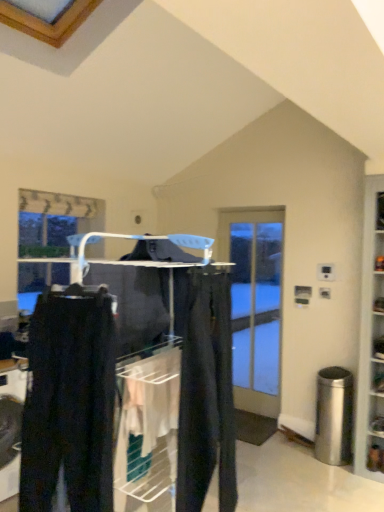
Describe the element at coordinates (128, 385) in the screenshot. I see `matte black pants at center` at that location.

What do you see at coordinates (255, 304) in the screenshot? The width and height of the screenshot is (384, 512). I see `clear glass door at center` at bounding box center [255, 304].

At what (x,y) coordinates should I click in order to perform the action: click on dark gray pants at center. Please return your answer as a coordinate pair (x, y). The image size is (384, 512). Looking at the image, I should click on (69, 402).

Which is behind, dark gray pants at center or matte black pants at center?

matte black pants at center is more distant.

From a real-world perspective, is dark gray pants at center physically below matte black pants at center?

No.

From the picture: From the image's perspective, is dark gray pants at center below matte black pants at center?

Actually, dark gray pants at center appears above matte black pants at center in the image.

From their relative heights in the image, would you say dark gray pants at center is taller or shorter than matte black pants at center?

Clearly, dark gray pants at center is shorter compared to matte black pants at center.

Is clear glass door at center taller or shorter than matte black pants at center?

In the image, clear glass door at center appears to be taller than matte black pants at center.

Identify the location of closet below the clear glass door at center (from a real-world perspective). The width and height of the screenshot is (384, 512). (128, 385).

Which is more to the left, clear glass door at center or matte black pants at center?

Positioned to the left is matte black pants at center.

In terms of size, does clear glass door at center appear bigger or smaller than matte black pants at center?

Clearly, clear glass door at center is smaller in size than matte black pants at center.

Can you confirm if matte black pants at center is smaller than clear glass door at center?

No, matte black pants at center is not smaller than clear glass door at center.

Could you tell me if matte black pants at center is facing clear glass door at center?

No, matte black pants at center is not facing towards clear glass door at center.

Visually, is matte black pants at center positioned to the left or to the right of clear glass door at center?

In the image, matte black pants at center appears on the left side of clear glass door at center.

How much distance is there between matte black pants at center and clear glass door at center?

The distance of matte black pants at center from clear glass door at center is 8.29 feet.

From the image's perspective, which is below, clear glass door at center or dark gray pants at center?

clear glass door at center, from the image's perspective.

Does clear glass door at center have a lesser height compared to dark gray pants at center?

No.

What's the angular difference between clear glass door at center and dark gray pants at center's facing directions?

2.02 degrees.

Between clear glass door at center and dark gray pants at center, which one appears on the left side from the viewer's perspective?

dark gray pants at center is more to the left.

Which is correct: matte black pants at center is inside dark gray pants at center, or outside of it?

matte black pants at center lies outside dark gray pants at center.

Based on the photo, which object is positioned more to the right, matte black pants at center or dark gray pants at center?

From the viewer's perspective, matte black pants at center appears more on the right side.

How many degrees apart are the facing directions of matte black pants at center and dark gray pants at center?

The angle between the facing direction of matte black pants at center and the facing direction of dark gray pants at center is 95.7 degrees.

Looking at their sizes, would you say matte black pants at center is wider or thinner than dark gray pants at center?

matte black pants at center is thinner than dark gray pants at center.

Looking at their sizes, would you say matte black pants at center is wider or thinner than matte black pants at center?

Clearly, matte black pants at center has less width compared to matte black pants at center.

Is matte black pants at center positioned far away from matte black pants at center?

Actually, matte black pants at center and matte black pants at center are a little close together.

Which is less distant, (193, 384) or (83, 352)?

Point (193, 384) is farther from the camera than point (83, 352).

Does matte black pants at center lie behind matte black pants at center?

Yes.

Do you think matte black pants at center is within clear glass door at center, or outside of it?

matte black pants at center is outside clear glass door at center.

From a real-world perspective, is matte black pants at center beneath clear glass door at center?

No, from a real-world perspective, matte black pants at center is not beneath clear glass door at center.

Considering the relative sizes of matte black pants at center and clear glass door at center in the image provided, is matte black pants at center wider than clear glass door at center?

No.

Find the location of a particular element. This screenshot has width=384, height=512. door above the matte black pants at center (from the image's perspective) is located at coordinates (255, 304).

Where is `trousers located in front of the matte black pants at center`? This screenshot has width=384, height=512. trousers located in front of the matte black pants at center is located at coordinates (69, 402).

The image size is (384, 512). I want to click on door that appears above the matte black pants at center (from a real-world perspective), so click(255, 304).

Based on their spatial positions, is matte black pants at center or clear glass door at center closer to dark gray pants at center?

matte black pants at center is closer to dark gray pants at center.

From the image, which object appears to be nearer to matte black pants at center, clear glass door at center or matte black pants at center?

Among the two, matte black pants at center is located nearer to matte black pants at center.

Which object lies nearer to the anchor point matte black pants at center, dark gray pants at center or clear glass door at center?

Based on the image, dark gray pants at center appears to be nearer to matte black pants at center.

Looking at the image, which one is located closer to dark gray pants at center, matte black pants at center or matte black pants at center?

matte black pants at center is closer to dark gray pants at center.

From the image, which object appears to be nearer to matte black pants at center, matte black pants at center or clear glass door at center?

Among the two, matte black pants at center is located nearer to matte black pants at center.

Which object lies nearer to the anchor point clear glass door at center, dark gray pants at center or matte black pants at center?

matte black pants at center is positioned closer to the anchor clear glass door at center.

Estimate the real-world distances between objects in this image. Which object is further from clear glass door at center, dark gray pants at center or matte black pants at center?

dark gray pants at center lies further to clear glass door at center than the other object.

Considering their positions, is matte black pants at center positioned closer to dark gray pants at center than clear glass door at center?

matte black pants at center is closer to dark gray pants at center.

Image resolution: width=384 pixels, height=512 pixels. I want to click on clothing between matte black pants at center and clear glass door at center in the front-back direction, so click(x=206, y=394).

The width and height of the screenshot is (384, 512). Identify the location of closet between dark gray pants at center and clear glass door at center from front to back. (128, 385).

What are the coordinates of `clothing positioned between dark gray pants at center and clear glass door at center from near to far` in the screenshot? It's located at 206,394.

Locate an element on the screen. closet between dark gray pants at center and matte black pants at center from left to right is located at coordinates (128, 385).